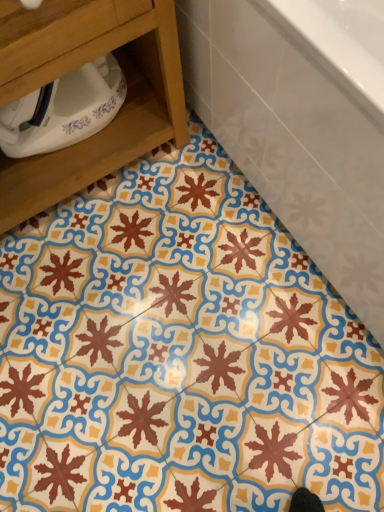
Question: Is wooden drawer at lower left taller or shorter than white glossy bathtub at upper right?

Choices:
 (A) short
 (B) tall

Answer: (B)

Question: Considering the positions of wooden drawer at lower left and white glossy bathtub at upper right in the image, is wooden drawer at lower left bigger or smaller than white glossy bathtub at upper right?

Choices:
 (A) small
 (B) big

Answer: (A)

Question: In terms of width, does wooden drawer at lower left look wider or thinner when compared to white glossy bathtub at upper right?

Choices:
 (A) thin
 (B) wide

Answer: (A)

Question: Considering the positions of white glossy bathtub at upper right and wooden drawer at lower left in the image, is white glossy bathtub at upper right bigger or smaller than wooden drawer at lower left?

Choices:
 (A) small
 (B) big

Answer: (B)

Question: From a real-world perspective, relative to wooden drawer at lower left, is white glossy bathtub at upper right vertically above or below?

Choices:
 (A) below
 (B) above

Answer: (A)

Question: From their relative heights in the image, would you say white glossy bathtub at upper right is taller or shorter than wooden drawer at lower left?

Choices:
 (A) tall
 (B) short

Answer: (B)

Question: Is white glossy bathtub at upper right to the left or to the right of wooden drawer at lower left in the image?

Choices:
 (A) right
 (B) left

Answer: (A)